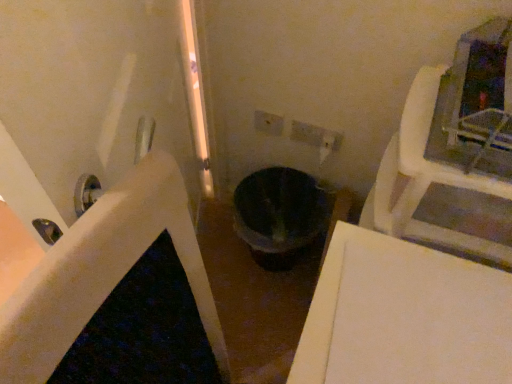
Question: From the image's perspective, would you say white plastic electric outlet at center is positioned over black matte toilet bowl at center?

Choices:
 (A) no
 (B) yes

Answer: (B)

Question: Is the depth of white plastic electric outlet at center greater than that of black matte toilet bowl at center?

Choices:
 (A) no
 (B) yes

Answer: (A)

Question: Is white plastic electric outlet at center to the right of black matte toilet bowl at center from the viewer's perspective?

Choices:
 (A) yes
 (B) no

Answer: (B)

Question: Does white plastic electric outlet at center have a greater width compared to black matte toilet bowl at center?

Choices:
 (A) no
 (B) yes

Answer: (A)

Question: Does white plastic electric outlet at center turn towards black matte toilet bowl at center?

Choices:
 (A) no
 (B) yes

Answer: (A)

Question: Is black matte toilet bowl at center to the left or to the right of black glossy bath at center in the image?

Choices:
 (A) right
 (B) left

Answer: (A)

Question: Is black matte toilet bowl at center in front of or behind black glossy bath at center in the image?

Choices:
 (A) behind
 (B) front

Answer: (A)

Question: Considering the positions of black matte toilet bowl at center and black glossy bath at center in the image, is black matte toilet bowl at center wider or thinner than black glossy bath at center?

Choices:
 (A) thin
 (B) wide

Answer: (A)

Question: From their relative heights in the image, would you say black matte toilet bowl at center is taller or shorter than black glossy bath at center?

Choices:
 (A) short
 (B) tall

Answer: (B)

Question: Is point (176, 170) closer or farther from the camera than point (251, 244)?

Choices:
 (A) farther
 (B) closer

Answer: (B)

Question: From the image's perspective, relative to black matte toilet bowl at center, is black glossy bath at center above or below?

Choices:
 (A) above
 (B) below

Answer: (B)

Question: Is black glossy bath at center taller or shorter than black matte toilet bowl at center?

Choices:
 (A) short
 (B) tall

Answer: (A)

Question: Considering their positions, is black glossy bath at center located in front of or behind black matte toilet bowl at center?

Choices:
 (A) front
 (B) behind

Answer: (A)

Question: From a real-world perspective, is black glossy bath at center physically located above or below white plastic electric outlet at center?

Choices:
 (A) above
 (B) below

Answer: (B)

Question: Is black glossy bath at center wider or thinner than white plastic electric outlet at center?

Choices:
 (A) wide
 (B) thin

Answer: (A)